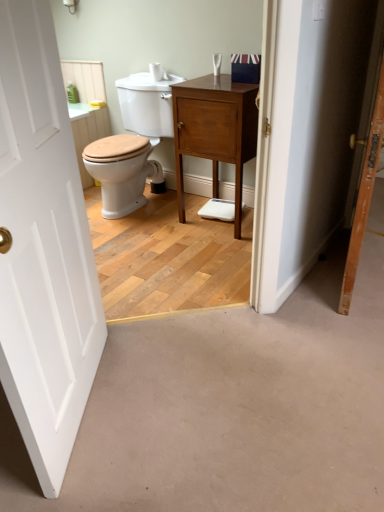
Find the location of `unoccupied area in front of wooden door at right, the second door in the left-to-right sequence`. unoccupied area in front of wooden door at right, the second door in the left-to-right sequence is located at coordinates (x=338, y=336).